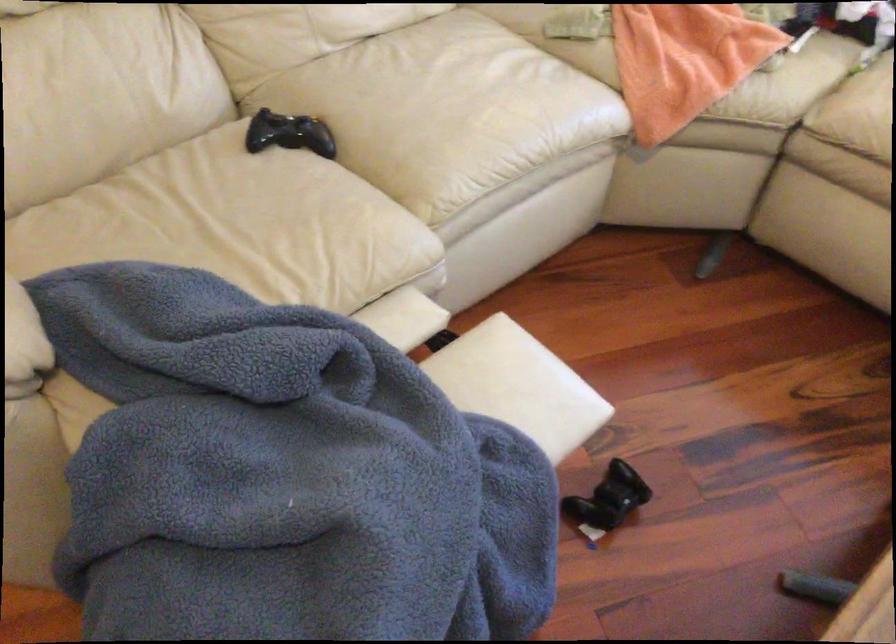
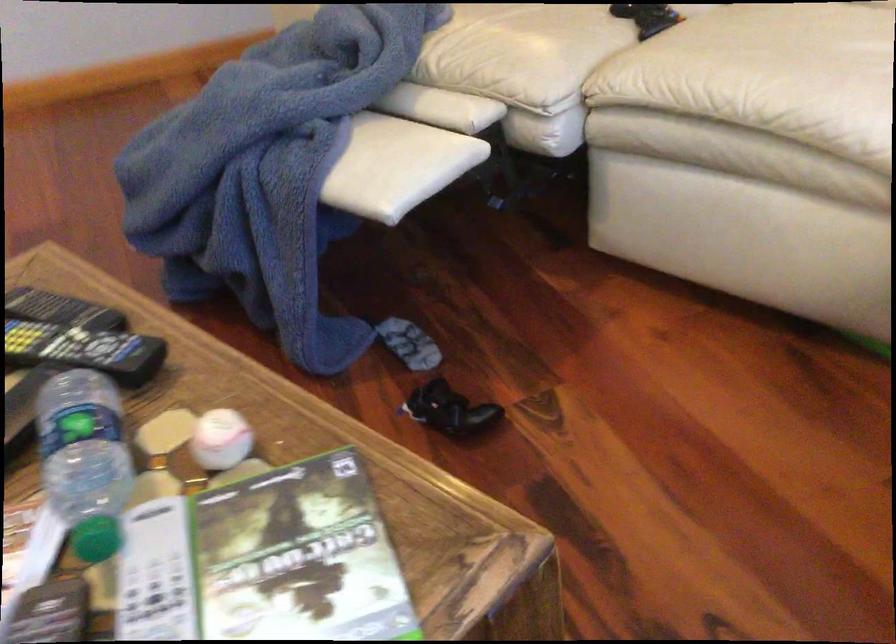
Where in the second image is the point corresponding to pixel 366 225 from the first image?

(524, 51)